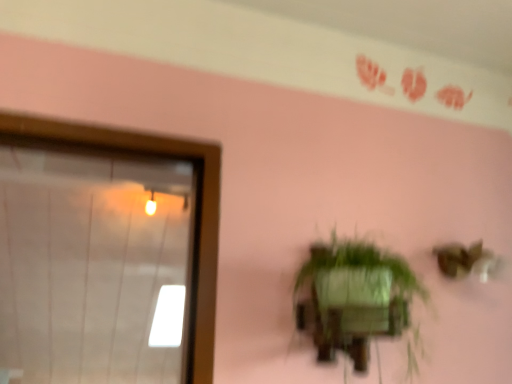
Locate an element on the screen. Image resolution: width=512 pixels, height=384 pixels. green matte houseplant at center is located at coordinates (x=354, y=298).

What do you see at coordinates (354, 298) in the screenshot? I see `green matte houseplant at center` at bounding box center [354, 298].

What is the approximate height of green matte houseplant at center?

It is 9.27 inches.

Find the location of a particular element. green matte houseplant at center is located at coordinates (354, 298).